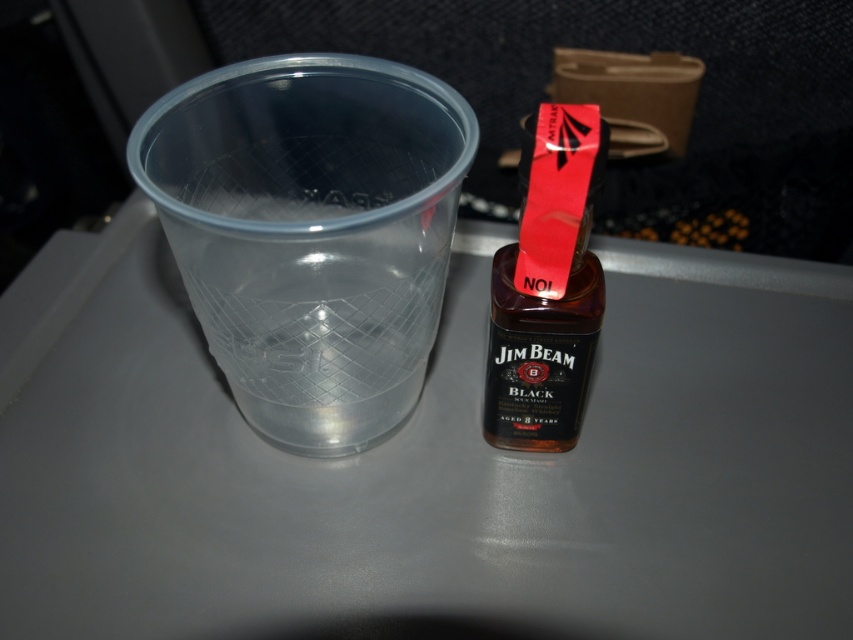
Does transparent plastic cup at left have a greater width compared to black glass jim beam bottle at center?

Indeed, transparent plastic cup at left has a greater width compared to black glass jim beam bottle at center.

Describe the element at coordinates (311, 234) in the screenshot. I see `transparent plastic cup at left` at that location.

Which is behind, point (407, 394) or point (503, 429)?

The point (407, 394) is more distant.

Where is `transparent plastic cup at left`? Image resolution: width=853 pixels, height=640 pixels. transparent plastic cup at left is located at coordinates (311, 234).